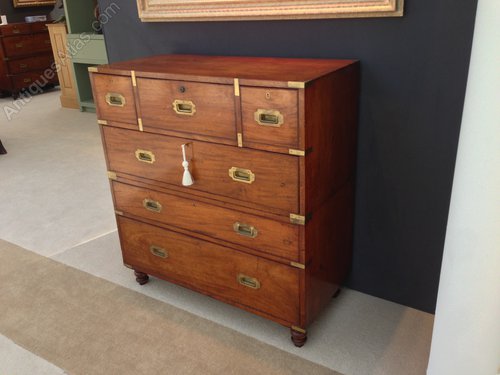
Locate an element on the screen. This screenshot has height=375, width=500. handle is located at coordinates (244, 179).